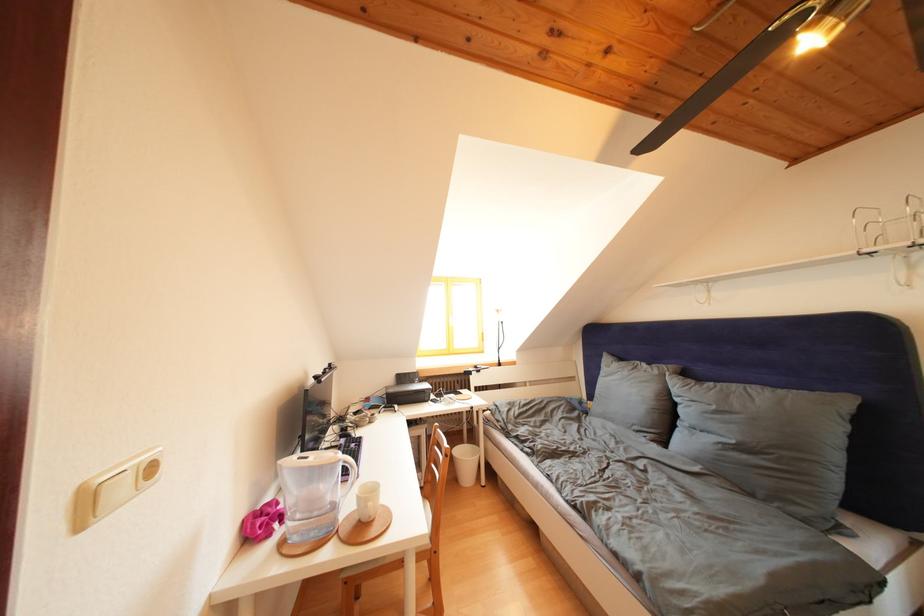
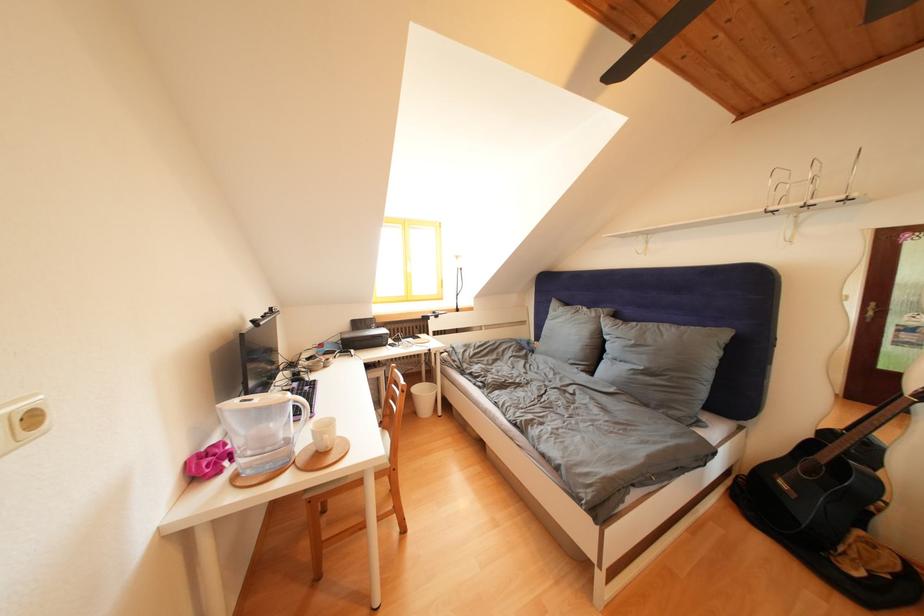
In the second image, find the point that corresponds to the point at 348,459 in the first image.

(297, 400)